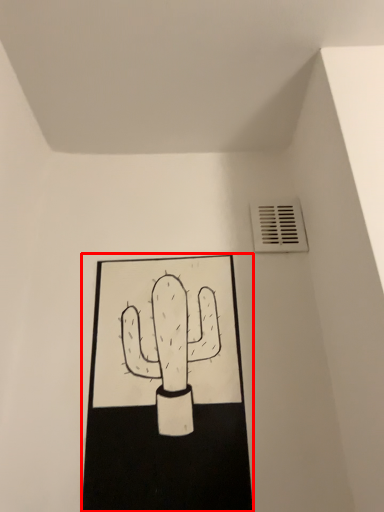
Question: From the image's perspective, where is sketch (annotated by the red box) located in relation to air conditioning in the image?

Choices:
 (A) above
 (B) below

Answer: (B)